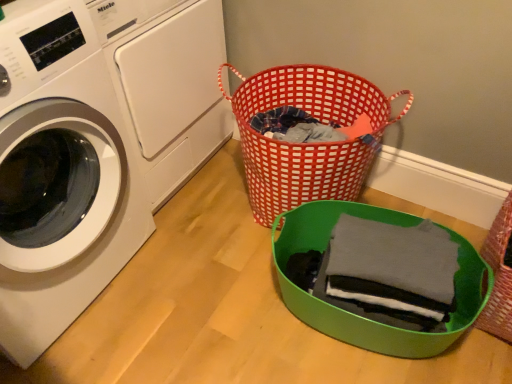
Measure the distance between point (8, 139) and camera.

The depth of point (8, 139) is 35.31 inches.

At what (x,y) coordinates should I click in order to perform the action: click on white glossy washing machine at upper left, which ranks as the second washing machine in front-to-back order. Please return your answer as a coordinate pair (x, y). Looking at the image, I should click on (167, 83).

At what (x,y) coordinates should I click in order to perform the action: click on red woven basket at center, placed as the 3th basket when sorted from right to left. Please return your answer as a coordinate pair (x, y). Looking at the image, I should click on (307, 144).

Locate an element on the screen. This screenshot has height=384, width=512. rustic woven basket at lower right, the third basket positioned from the left is located at coordinates (498, 276).

Is dark gray cotton shirt at center with red woven basket at center, placed as the first basket when sorted from left to right?

No.

From a real-world perspective, is dark gray cotton shirt at center positioned over red woven basket at center, placed as the 3th basket when sorted from right to left, based on gravity?

Yes.

From the image's perspective, does green plastic basket at lower right, positioned as the second basket in right-to-left order, appear lower than dark gray cotton shirt at center?

Yes, from the image's perspective, green plastic basket at lower right, positioned as the second basket in right-to-left order, is below dark gray cotton shirt at center.

Does green plastic basket at lower right, positioned as the second basket in right-to-left order, come behind dark gray cotton shirt at center?

No, it is not.

Do you think green plastic basket at lower right, the second basket in the left-to-right sequence, is within dark gray cotton shirt at center, or outside of it?

green plastic basket at lower right, the second basket in the left-to-right sequence, exists outside the volume of dark gray cotton shirt at center.

Is white glossy washing machine at left, arranged as the 1th washing machine when viewed from the front, inside red woven basket at center, placed as the first basket when sorted from left to right?

No, white glossy washing machine at left, arranged as the 1th washing machine when viewed from the front, is located outside of red woven basket at center, placed as the first basket when sorted from left to right.

Considering the relative sizes of red woven basket at center, placed as the 3th basket when sorted from right to left, and white glossy washing machine at left, which appears as the second washing machine when viewed from the back, in the image provided, is red woven basket at center, placed as the 3th basket when sorted from right to left, bigger than white glossy washing machine at left, which appears as the second washing machine when viewed from the back,?

No.

From the picture: Is red woven basket at center, placed as the 3th basket when sorted from right to left, oriented away from white glossy washing machine at left, which appears as the second washing machine when viewed from the back?

That's not correct — red woven basket at center, placed as the 3th basket when sorted from right to left, is not looking away from white glossy washing machine at left, which appears as the second washing machine when viewed from the back.

Is red woven basket at center, placed as the 3th basket when sorted from right to left, positioned far away from white glossy washing machine at left, which appears as the second washing machine when viewed from the back?

No, red woven basket at center, placed as the 3th basket when sorted from right to left, is in close proximity to white glossy washing machine at left, which appears as the second washing machine when viewed from the back.

Is green plastic basket at lower right, positioned as the second basket in right-to-left order, a part of rustic woven basket at lower right, the third basket positioned from the left?

No, green plastic basket at lower right, positioned as the second basket in right-to-left order, is located outside of rustic woven basket at lower right, the third basket positioned from the left.

Are rustic woven basket at lower right, the third basket positioned from the left, and green plastic basket at lower right, the second basket in the left-to-right sequence, far apart?

No, rustic woven basket at lower right, the third basket positioned from the left, is in close proximity to green plastic basket at lower right, the second basket in the left-to-right sequence.

Looking at the image, does rustic woven basket at lower right, the 1th basket viewed from the right, seem bigger or smaller compared to green plastic basket at lower right, the second basket in the left-to-right sequence?

rustic woven basket at lower right, the 1th basket viewed from the right, is smaller than green plastic basket at lower right, the second basket in the left-to-right sequence.

The width and height of the screenshot is (512, 384). I want to click on the 1st basket located above the green plastic basket at lower right, the second basket in the left-to-right sequence (from a real-world perspective), so click(498, 276).

Does green plastic basket at lower right, positioned as the second basket in right-to-left order, have a lesser height compared to rustic woven basket at lower right, the 1th basket viewed from the right?

Correct, green plastic basket at lower right, positioned as the second basket in right-to-left order, is not as tall as rustic woven basket at lower right, the 1th basket viewed from the right.

Measure the distance between green plastic basket at lower right, the second basket in the left-to-right sequence, and rustic woven basket at lower right, the third basket positioned from the left.

green plastic basket at lower right, the second basket in the left-to-right sequence, is 25.58 centimeters away from rustic woven basket at lower right, the third basket positioned from the left.

Are green plastic basket at lower right, positioned as the second basket in right-to-left order, and rustic woven basket at lower right, the 1th basket viewed from the right, far apart?

No.

Between green plastic basket at lower right, the second basket in the left-to-right sequence, and rustic woven basket at lower right, the third basket positioned from the left, which one is positioned behind?

rustic woven basket at lower right, the third basket positioned from the left, is further from the camera.

Is the depth of dark gray cotton shirt at center greater than that of green plastic basket at lower right, the second basket in the left-to-right sequence?

Yes, dark gray cotton shirt at center is behind green plastic basket at lower right, the second basket in the left-to-right sequence.

Considering the sizes of dark gray cotton shirt at center and green plastic basket at lower right, positioned as the second basket in right-to-left order, in the image, is dark gray cotton shirt at center wider or thinner than green plastic basket at lower right, positioned as the second basket in right-to-left order,?

In the image, dark gray cotton shirt at center appears to be more narrow than green plastic basket at lower right, positioned as the second basket in right-to-left order.

Can you tell me how much dark gray cotton shirt at center and green plastic basket at lower right, the second basket in the left-to-right sequence, differ in facing direction?

The angle between the facing direction of dark gray cotton shirt at center and the facing direction of green plastic basket at lower right, the second basket in the left-to-right sequence, is 2.67 degrees.

Could you tell me if dark gray cotton shirt at center is facing green plastic basket at lower right, the second basket in the left-to-right sequence?

Yes, dark gray cotton shirt at center is oriented towards green plastic basket at lower right, the second basket in the left-to-right sequence.

Is point (110, 149) closer to viewer compared to point (170, 154)?

Yes, it is in front of point (170, 154).

Locate an element on the screen. Image resolution: width=512 pixels, height=384 pixels. washing machine above the white glossy washing machine at upper left, arranged as the first washing machine when viewed from the back (from a real-world perspective) is located at coordinates (59, 175).

Would you say white glossy washing machine at left, which appears as the second washing machine when viewed from the back, is outside white glossy washing machine at upper left, which ranks as the second washing machine in front-to-back order?

Yes.

Based on the photo, between white glossy washing machine at left, which appears as the second washing machine when viewed from the back, and white glossy washing machine at upper left, arranged as the first washing machine when viewed from the back, which one has more height?

white glossy washing machine at left, which appears as the second washing machine when viewed from the back.

Image resolution: width=512 pixels, height=384 pixels. In order to click on clothing located in front of the red woven basket at center, placed as the 3th basket when sorted from right to left in this screenshot , I will do `click(391, 271)`.

The image size is (512, 384). Identify the location of clothing above the green plastic basket at lower right, positioned as the second basket in right-to-left order (from the image's perspective). (391, 271).

Considering their positions, is dark gray cotton shirt at center positioned closer to white glossy washing machine at upper left, arranged as the first washing machine when viewed from the back, than white glossy washing machine at left, arranged as the 1th washing machine when viewed from the front?

Based on the image, white glossy washing machine at left, arranged as the 1th washing machine when viewed from the front, appears to be nearer to white glossy washing machine at upper left, arranged as the first washing machine when viewed from the back.

Which object lies nearer to the anchor point white glossy washing machine at left, arranged as the 1th washing machine when viewed from the front, red woven basket at center, placed as the first basket when sorted from left to right, or white glossy washing machine at upper left, which ranks as the second washing machine in front-to-back order?

Based on the image, white glossy washing machine at upper left, which ranks as the second washing machine in front-to-back order, appears to be nearer to white glossy washing machine at left, arranged as the 1th washing machine when viewed from the front.

From the image, which object appears to be nearer to green plastic basket at lower right, the second basket in the left-to-right sequence, red woven basket at center, placed as the 3th basket when sorted from right to left, or white glossy washing machine at upper left, which ranks as the second washing machine in front-to-back order?

red woven basket at center, placed as the 3th basket when sorted from right to left, is closer to green plastic basket at lower right, the second basket in the left-to-right sequence.

In the scene shown: Considering their positions, is red woven basket at center, placed as the first basket when sorted from left to right, positioned closer to white glossy washing machine at upper left, which ranks as the second washing machine in front-to-back order, than rustic woven basket at lower right, the third basket positioned from the left?

red woven basket at center, placed as the first basket when sorted from left to right.

Considering their positions, is white glossy washing machine at upper left, arranged as the first washing machine when viewed from the back, positioned further to dark gray cotton shirt at center than green plastic basket at lower right, the second basket in the left-to-right sequence?

white glossy washing machine at upper left, arranged as the first washing machine when viewed from the back, is positioned further to the anchor dark gray cotton shirt at center.

Which object lies nearer to the anchor point dark gray cotton shirt at center, rustic woven basket at lower right, the third basket positioned from the left, or red woven basket at center, placed as the 3th basket when sorted from right to left?

The object closer to dark gray cotton shirt at center is rustic woven basket at lower right, the third basket positioned from the left.

When comparing their distances from red woven basket at center, placed as the first basket when sorted from left to right, does white glossy washing machine at left, which appears as the second washing machine when viewed from the back, or white glossy washing machine at upper left, arranged as the first washing machine when viewed from the back, seem further?

white glossy washing machine at left, which appears as the second washing machine when viewed from the back, is positioned further to the anchor red woven basket at center, placed as the first basket when sorted from left to right.

When comparing their distances from dark gray cotton shirt at center, does green plastic basket at lower right, positioned as the second basket in right-to-left order, or rustic woven basket at lower right, the 1th basket viewed from the right, seem closer?

green plastic basket at lower right, positioned as the second basket in right-to-left order, is closer to dark gray cotton shirt at center.

The image size is (512, 384). I want to click on basket between red woven basket at center, placed as the 3th basket when sorted from right to left, and rustic woven basket at lower right, the third basket positioned from the left, in the horizontal direction, so click(x=359, y=316).

Where is `clothing located between white glossy washing machine at upper left, arranged as the first washing machine when viewed from the back, and rustic woven basket at lower right, the 1th basket viewed from the right, in the left-right direction`? Image resolution: width=512 pixels, height=384 pixels. clothing located between white glossy washing machine at upper left, arranged as the first washing machine when viewed from the back, and rustic woven basket at lower right, the 1th basket viewed from the right, in the left-right direction is located at coordinates (391, 271).

Locate an element on the screen. This screenshot has width=512, height=384. clothing between green plastic basket at lower right, positioned as the second basket in right-to-left order, and rustic woven basket at lower right, the third basket positioned from the left is located at coordinates (391, 271).

Locate an element on the screen. clothing between red woven basket at center, placed as the 3th basket when sorted from right to left, and rustic woven basket at lower right, the third basket positioned from the left, in the horizontal direction is located at coordinates 391,271.